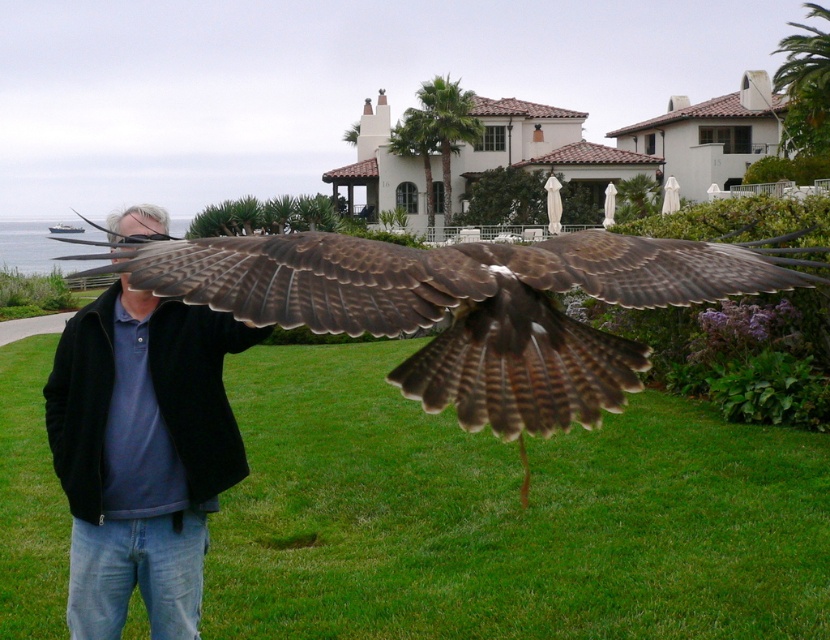
Which of these two, brown feathered falcon at center or blue cotton shirt at center, stands shorter?

With less height is brown feathered falcon at center.

Between brown feathered falcon at center and blue cotton shirt at center, which one has more height?

blue cotton shirt at center

Which is in front, point (233, 257) or point (189, 506)?

Point (233, 257) is in front.

Locate an element on the screen. This screenshot has height=640, width=830. brown feathered falcon at center is located at coordinates (467, 307).